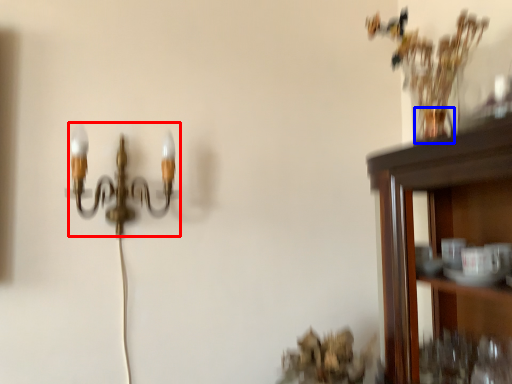
Question: Which object is further to the camera taking this photo, lamp (highlighted by a red box) or vase (highlighted by a blue box)?

Choices:
 (A) lamp
 (B) vase

Answer: (A)